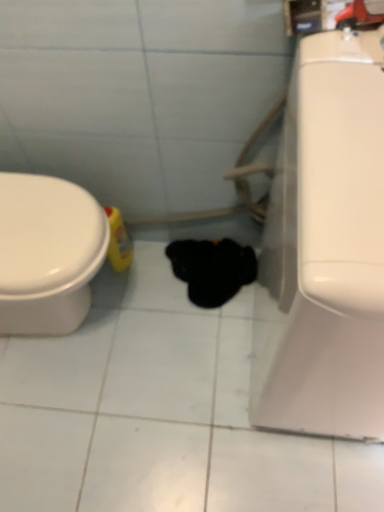
What do you see at coordinates (212, 269) in the screenshot?
I see `black fuzzy cat at center` at bounding box center [212, 269].

Identify the location of black fuzzy cat at center. (212, 269).

What is the approximate height of white glossy toilet at right?

The height of white glossy toilet at right is 35.49 inches.

This screenshot has height=512, width=384. What do you see at coordinates (325, 249) in the screenshot?
I see `white glossy toilet at right` at bounding box center [325, 249].

The height and width of the screenshot is (512, 384). What are the coordinates of `white glossy toilet at right` in the screenshot? It's located at (325, 249).

Image resolution: width=384 pixels, height=512 pixels. In order to click on black fuzzy cat at center in this screenshot , I will do `click(212, 269)`.

Is black fuzzy cat at center to the left of white glossy toilet at right from the viewer's perspective?

Indeed, black fuzzy cat at center is positioned on the left side of white glossy toilet at right.

Is the depth of black fuzzy cat at center less than that of white glossy toilet at right?

No, it is not.

Is point (199, 285) closer or farther from the camera than point (379, 386)?

Point (199, 285) appears to be farther away from the viewer than point (379, 386).

From the image's perspective, is black fuzzy cat at center above or below white glossy toilet at right?

Based on their image positions, black fuzzy cat at center is located beneath white glossy toilet at right.

From a real-world perspective, is black fuzzy cat at center located higher than white glossy toilet at right?

No, from a real-world perspective, black fuzzy cat at center is not over white glossy toilet at right

Can you confirm if black fuzzy cat at center is thinner than white glossy toilet at right?

Yes, black fuzzy cat at center is thinner than white glossy toilet at right.

Which of these two, black fuzzy cat at center or white glossy toilet at right, stands shorter?

black fuzzy cat at center.

Considering the sizes of objects black fuzzy cat at center and white glossy toilet at right in the image provided, who is smaller, black fuzzy cat at center or white glossy toilet at right?

black fuzzy cat at center is smaller.

Is black fuzzy cat at center inside or outside of white glossy toilet at right?

black fuzzy cat at center is not enclosed by white glossy toilet at right.

Are black fuzzy cat at center and white glossy toilet at right making contact?

No, black fuzzy cat at center is not making contact with white glossy toilet at right.

Based on the photo, is black fuzzy cat at center positioned with its back to white glossy toilet at right?

No.

This screenshot has width=384, height=512. I want to click on animal that is behind the white glossy toilet at right, so [x=212, y=269].

Considering the relative positions of white glossy toilet at right and black fuzzy cat at center in the image provided, is white glossy toilet at right to the left or to the right of black fuzzy cat at center?

From the image, it's evident that white glossy toilet at right is to the right of black fuzzy cat at center.

Looking at this image, relative to black fuzzy cat at center, is white glossy toilet at right in front or behind?

white glossy toilet at right is in front of black fuzzy cat at center.

Which is closer to the camera, [383,291] or [240,264]?

Point [383,291] is positioned closer to the camera compared to point [240,264].

From the image's perspective, which one is positioned higher, white glossy toilet at right or black fuzzy cat at center?

white glossy toilet at right, from the image's perspective.

From a real-world perspective, relative to black fuzzy cat at center, is white glossy toilet at right vertically above or below?

white glossy toilet at right is above black fuzzy cat at center.

Considering the sizes of objects white glossy toilet at right and black fuzzy cat at center in the image provided, who is wider, white glossy toilet at right or black fuzzy cat at center?

white glossy toilet at right is wider.

Looking at this image, which of these two, white glossy toilet at right or black fuzzy cat at center, stands shorter?

black fuzzy cat at center.

Does white glossy toilet at right have a smaller size compared to black fuzzy cat at center?

No.

Is white glossy toilet at right completely or partially outside of black fuzzy cat at center?

Yes.

Is white glossy toilet at right far from black fuzzy cat at center?

They are positioned close to each other.

Is white glossy toilet at right oriented towards black fuzzy cat at center?

No, white glossy toilet at right is not aimed at black fuzzy cat at center.

How many degrees apart are the facing directions of white glossy toilet at right and black fuzzy cat at center?

0.259 degrees separate the facing orientations of white glossy toilet at right and black fuzzy cat at center.

At what (x,y) coordinates should I click in order to perform the action: click on porcelain in front of the black fuzzy cat at center. Please return your answer as a coordinate pair (x, y). This screenshot has width=384, height=512. Looking at the image, I should click on (325, 249).

Locate an element on the screen. animal located behind the white glossy toilet at right is located at coordinates (212, 269).

Where is `porcelain in front of the black fuzzy cat at center`? porcelain in front of the black fuzzy cat at center is located at coordinates (325, 249).